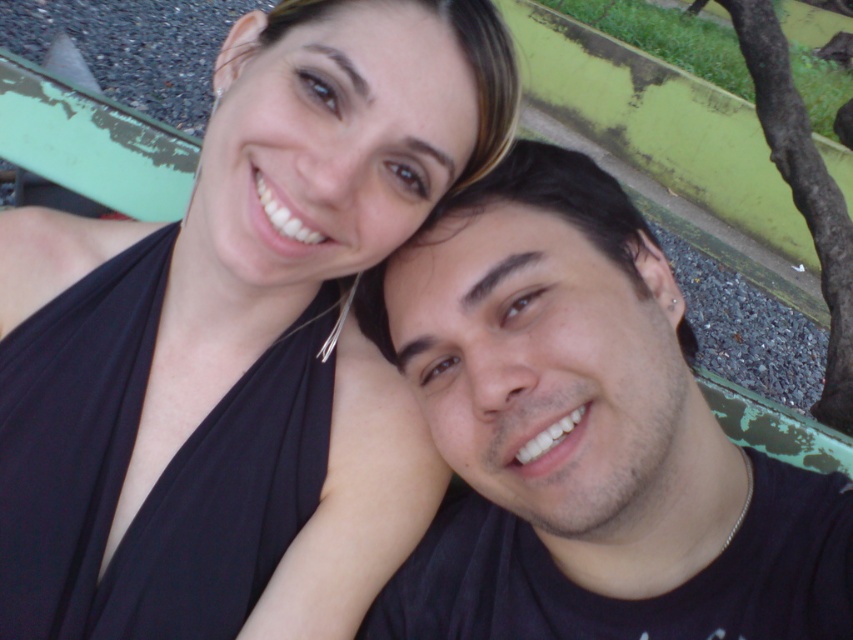
You are planning to take a photo of the black fabric at upper left and the black matte shirt at center. Which object should you focus on first if you want to capture both in the frame without moving the camera?

The black fabric at upper left is wider than the black matte shirt at center, so you should focus on the black fabric at upper left first to ensure it fits within the frame.